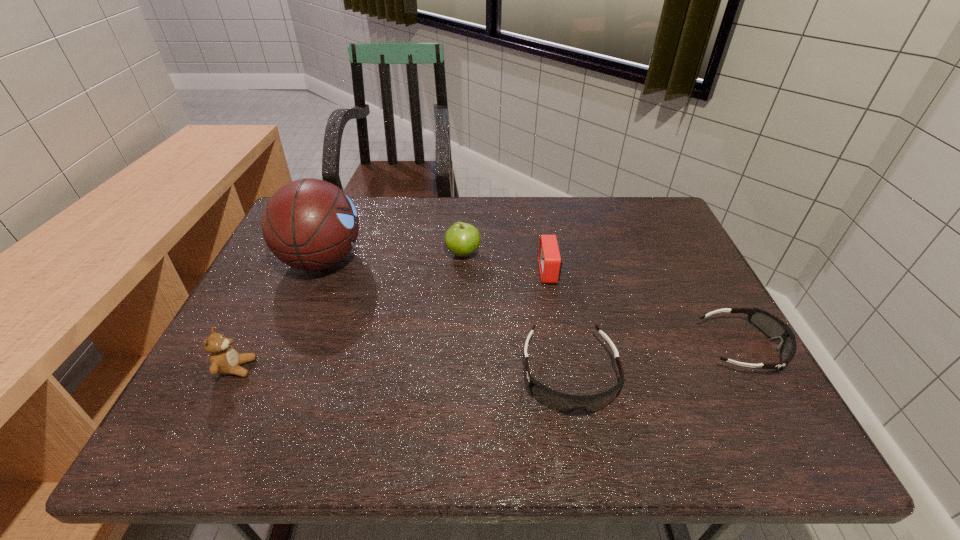
This screenshot has height=540, width=960. I want to click on vacant space located on the front-facing side of the fourth tallest object, so click(x=494, y=272).

Where is `free region located 0.220m on the front-facing side of the fourth tallest object`? This screenshot has height=540, width=960. free region located 0.220m on the front-facing side of the fourth tallest object is located at coordinates click(x=458, y=272).

The height and width of the screenshot is (540, 960). Identify the location of vacant region located 0.270m on the right of the fourth object from right to left. (576, 254).

I want to click on free spot located on the front-facing side of the teddy bear, so click(x=355, y=368).

I want to click on object positioned at the far edge, so click(310, 224).

At what (x,y) coordinates should I click in order to perform the action: click on teddy bear that is at the near edge. Please return your answer as a coordinate pair (x, y). The width and height of the screenshot is (960, 540). Looking at the image, I should click on (224, 359).

Find the location of `basketball present at the left edge`. basketball present at the left edge is located at coordinates (310, 224).

You are a GUI agent. You are given a task and a screenshot of the screen. Output one action in this format:
    pyautogui.click(x=<x>, y=<y>)
    Task: Click on the teddy bear that is at the left edge
    
    Given the screenshot: What is the action you would take?
    pyautogui.click(x=224, y=359)

The width and height of the screenshot is (960, 540). I want to click on object at the right edge, so click(x=773, y=327).

Find the location of a particular element. The image size is (960, 540). object present at the far left corner is located at coordinates (310, 224).